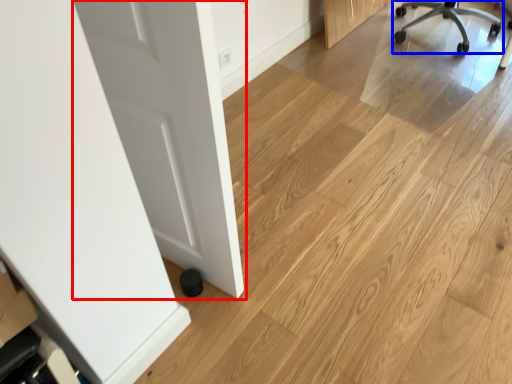
Question: Which object appears farthest to the camera in this image, door (highlighted by a red box) or chair (highlighted by a blue box)?

Choices:
 (A) door
 (B) chair

Answer: (B)